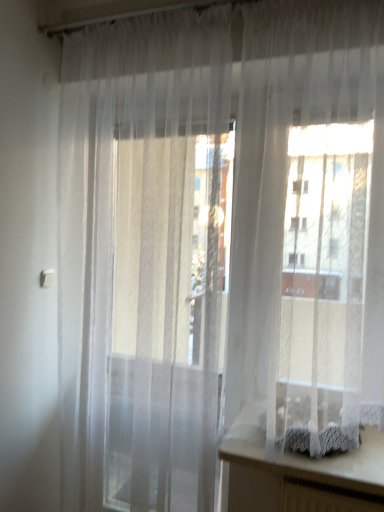
Find the location of a particular element. free space below sheer white curtain at center (from a real-world perspective) is located at coordinates (280, 454).